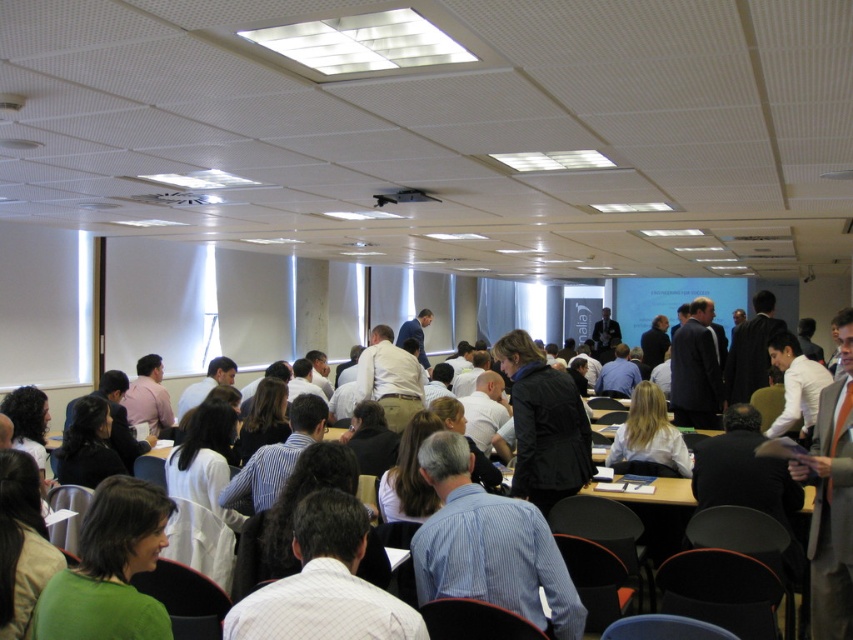
Is point (289, 593) positioned behind point (558, 412)?

No, (289, 593) is closer to viewer.

Does white striped shirt at center appear on the right side of dark brown leather jacket at center?

In fact, white striped shirt at center is to the left of dark brown leather jacket at center.

The image size is (853, 640). In order to click on white striped shirt at center in this screenshot , I will do `click(323, 582)`.

The height and width of the screenshot is (640, 853). Find the location of `white striped shirt at center`. white striped shirt at center is located at coordinates (323, 582).

Does white striped shirt at center appear on the left side of blonde hair at center?

Indeed, white striped shirt at center is positioned on the left side of blonde hair at center.

Locate an element on the screen. Image resolution: width=853 pixels, height=640 pixels. white striped shirt at center is located at coordinates (323, 582).

Who is positioned more to the left, blue striped shirt at center or white striped shirt at center?

Positioned to the left is white striped shirt at center.

Who is lower down, blue striped shirt at center or white striped shirt at center?

blue striped shirt at center

Which is behind, point (502, 593) or point (321, 513)?

Positioned behind is point (502, 593).

Image resolution: width=853 pixels, height=640 pixels. I want to click on blue striped shirt at center, so click(x=488, y=545).